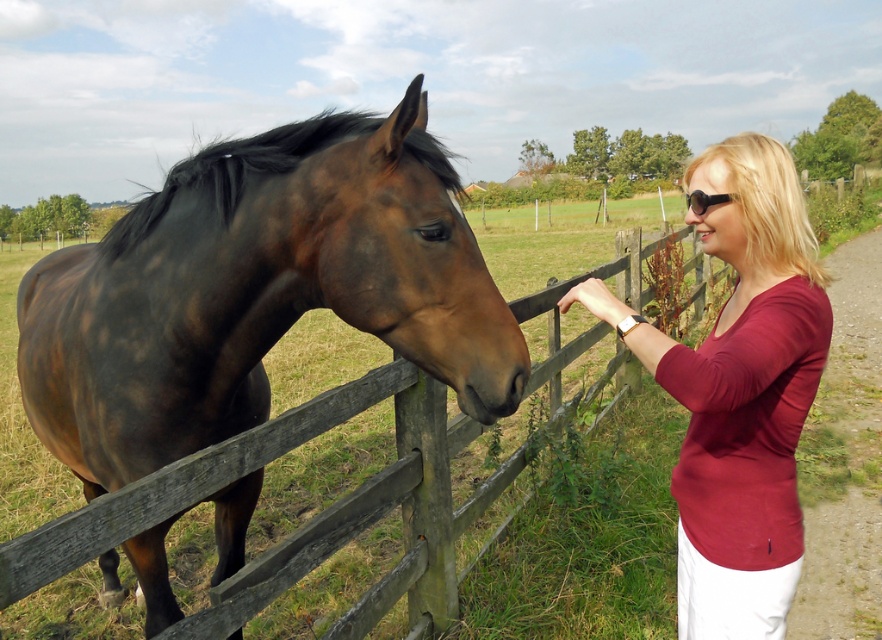
Does point (192, 168) lie in front of point (771, 522)?

No, it is behind (771, 522).

Locate an element on the screen. This screenshot has width=882, height=640. brown glossy horse at left is located at coordinates (258, 291).